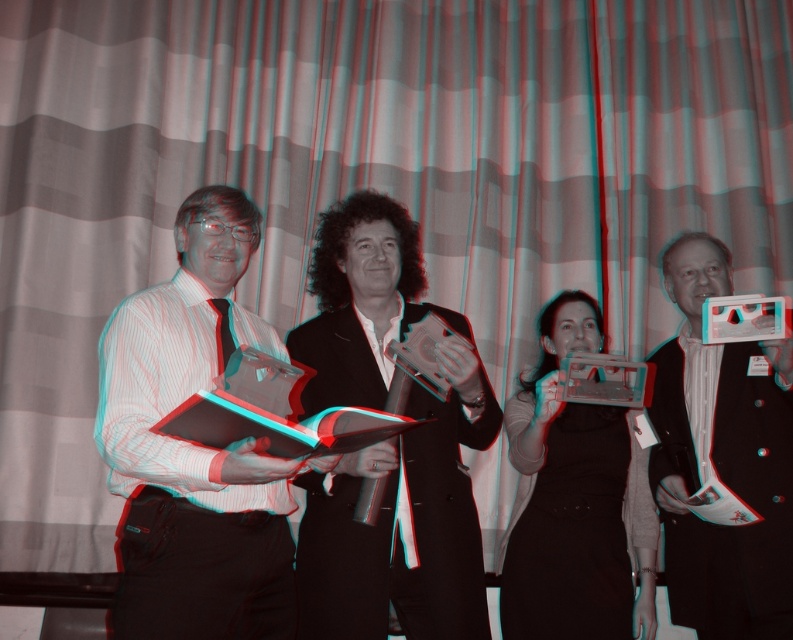
Question: Among these objects, which one is nearest to the camera?

Choices:
 (A) shiny silver award at center
 (B) matte black dress at center
 (C) matte black book at left

Answer: (C)

Question: Which object appears farthest from the camera in this image?

Choices:
 (A) matte black book at left
 (B) shiny silver award at center
 (C) matte black dress at center
 (D) black glossy book at center

Answer: (C)

Question: Does black glossy book at center appear over shiny silver award at center?

Choices:
 (A) no
 (B) yes

Answer: (B)

Question: Which object appears closest to the camera in this image?

Choices:
 (A) matte black dress at center
 (B) matte black book at left

Answer: (B)

Question: Does black glossy book at center appear on the right side of matte black dress at center?

Choices:
 (A) no
 (B) yes

Answer: (A)

Question: Does matte black book at left appear under matte black dress at center?

Choices:
 (A) no
 (B) yes

Answer: (A)